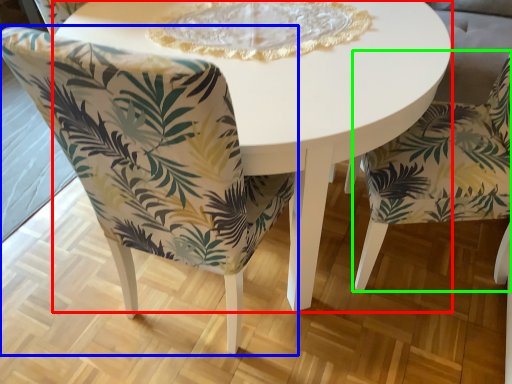
Question: Which object is positioned farthest from coffee table (highlighted by a red box)? Select from chair (highlighted by a blue box) and chair (highlighted by a green box).

Choices:
 (A) chair
 (B) chair

Answer: (B)